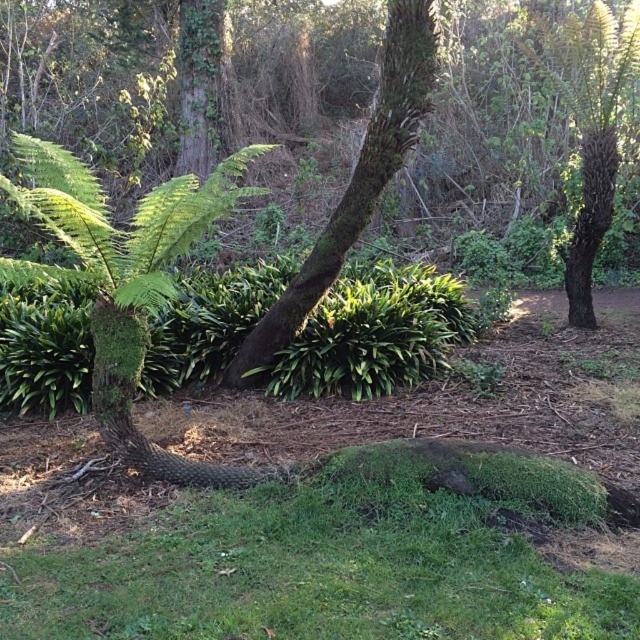
In the scene shown: Does green mossy bark tree at center appear on the left side of green mossy tree at upper right?

Yes, green mossy bark tree at center is to the left of green mossy tree at upper right.

Between green mossy bark tree at center and green mossy tree at upper right, which one is positioned lower?

green mossy bark tree at center is lower down.

Locate an element on the screen. The height and width of the screenshot is (640, 640). green mossy bark tree at center is located at coordinates (353, 182).

At what (x,y) coordinates should I click in order to perform the action: click on green mossy bark tree at center. Please return your answer as a coordinate pair (x, y). The image size is (640, 640). Looking at the image, I should click on (353, 182).

Which is more to the right, green mossy grass at lower center or green mossy bark tree at center?

Positioned to the right is green mossy grass at lower center.

Is green mossy grass at lower center to the left of green mossy bark tree at center from the viewer's perspective?

Incorrect, green mossy grass at lower center is not on the left side of green mossy bark tree at center.

Is point (557, 586) in front of point (371, 163)?

Yes, it is in front of point (371, 163).

You are a GUI agent. You are given a task and a screenshot of the screen. Output one action in this format:
    pyautogui.click(x=<x>, y=<y>)
    Task: Click on the green mossy grass at lower center
    This screenshot has width=640, height=640.
    Given the screenshot: What is the action you would take?
    pyautogui.click(x=339, y=557)

Consider the image. How far apart are green mossy grass at lower center and green mossy tree at upper right?

green mossy grass at lower center and green mossy tree at upper right are 5.39 meters apart from each other.

Based on the photo, who is lower down, green mossy grass at lower center or green mossy tree at upper right?

green mossy grass at lower center is below.

Which is in front, point (492, 454) or point (592, 182)?

Point (492, 454) is more forward.

Where is `green mossy grass at lower center`? green mossy grass at lower center is located at coordinates (339, 557).